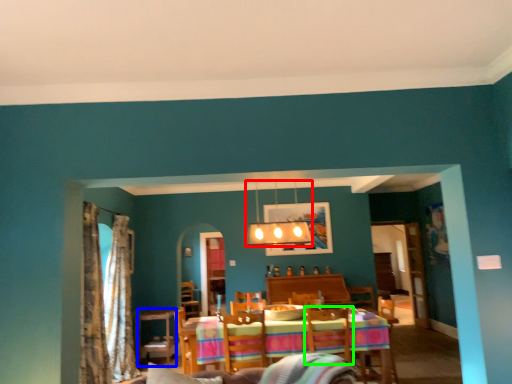
Question: Which object is the closest to the lamp (highlighted by a red box)? Choose among these: table (highlighted by a blue box) or swivel chair (highlighted by a green box).

Choices:
 (A) table
 (B) swivel chair

Answer: (B)